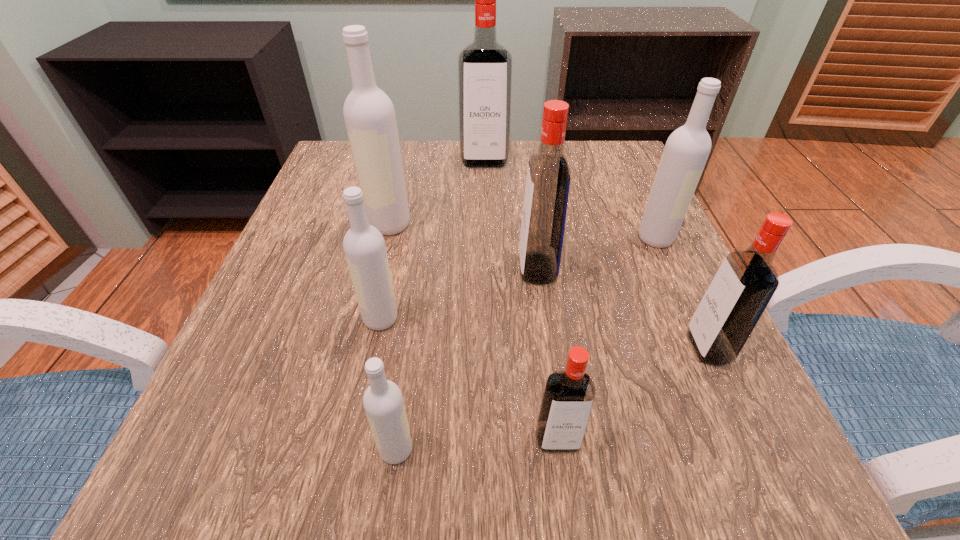
Identify the location of the farthest red vodka. (484, 67).

Locate an element on the screen. This screenshot has height=540, width=960. the leftmost red vodka is located at coordinates (484, 67).

Locate an element on the screen. This screenshot has width=960, height=540. the biggest white vodka is located at coordinates (369, 114).

You are a GUI agent. You are given a task and a screenshot of the screen. Output one action in this format:
    pyautogui.click(x=<x>, y=<y>)
    Task: Click on the rightmost white vodka
    
    Given the screenshot: What is the action you would take?
    pyautogui.click(x=686, y=151)

Locate an element on the screen. The image size is (960, 540). the fifth nearest vodka is located at coordinates (547, 187).

The height and width of the screenshot is (540, 960). I want to click on the third smallest red vodka, so click(x=547, y=187).

This screenshot has width=960, height=540. What are the coordinates of `the third biggest white vodka` in the screenshot? It's located at (364, 246).

Where is `the rightmost red vodka`? the rightmost red vodka is located at coordinates (747, 279).

Locate an element on the screen. The height and width of the screenshot is (540, 960). the third farthest red vodka is located at coordinates (747, 279).

Identify the location of the nearest red vodka. (568, 397).